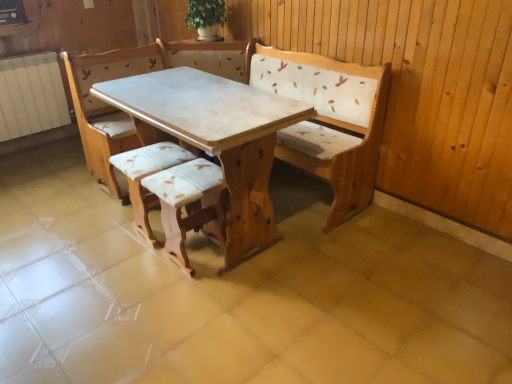
The image size is (512, 384). Find the location of `vacant space that is to the left of wooden armchair at center, which is the 2th armchair in left-to-right order`. vacant space that is to the left of wooden armchair at center, which is the 2th armchair in left-to-right order is located at coordinates (128, 266).